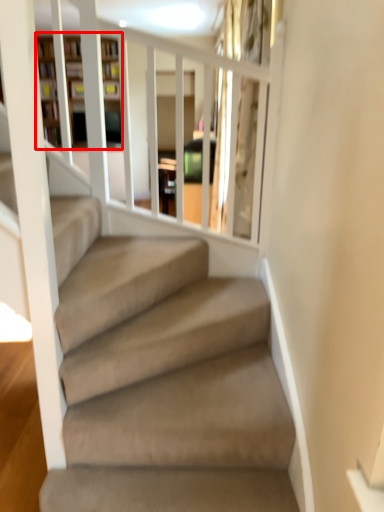
Question: In this image, where is bookshelf (annotated by the red box) located relative to glass door?

Choices:
 (A) right
 (B) left

Answer: (B)